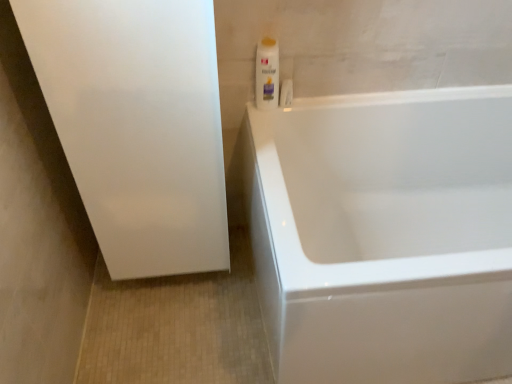
Where is `vacant area that is in front of white matte screen door at left`? Image resolution: width=512 pixels, height=384 pixels. vacant area that is in front of white matte screen door at left is located at coordinates (172, 336).